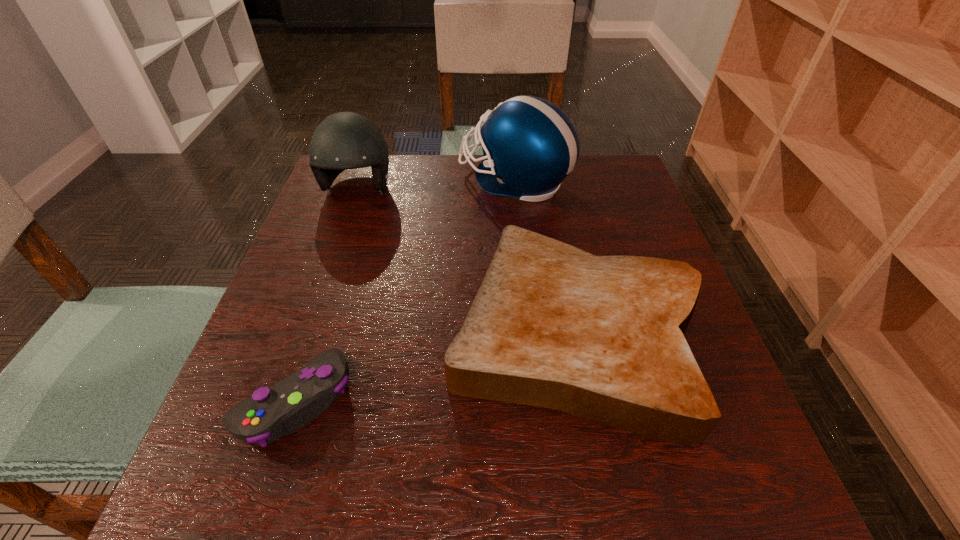
Find the location of `free space at the near right corner of the desktop`. free space at the near right corner of the desktop is located at coordinates (690, 503).

You are a GUI agent. You are given a task and a screenshot of the screen. Output one action in this format:
    pyautogui.click(x=<x>, y=<y>)
    Task: Click on the free space between the shortest object and the left football helmet
    The width and height of the screenshot is (960, 540).
    Given the screenshot: What is the action you would take?
    pyautogui.click(x=326, y=295)

You are a GUI agent. You are given a task and a screenshot of the screen. Output one action in this format:
    pyautogui.click(x=<x>, y=<y>)
    Task: Click on the free space that is in between the shortest object and the left football helmet
    
    Given the screenshot: What is the action you would take?
    click(x=326, y=295)

Identify the location of free space between the shortest object and the right football helmet. (404, 291).

Where is `vacant space in between the left football helmet and the shortest object`? The width and height of the screenshot is (960, 540). vacant space in between the left football helmet and the shortest object is located at coordinates (326, 295).

Where is `empty space between the shortest object and the right football helmet`? The height and width of the screenshot is (540, 960). empty space between the shortest object and the right football helmet is located at coordinates (404, 291).

Where is `empty space between the left football helmet and the right football helmet`? The height and width of the screenshot is (540, 960). empty space between the left football helmet and the right football helmet is located at coordinates (436, 185).

Find the location of `empty space that is in between the shortest object and the bread`. empty space that is in between the shortest object and the bread is located at coordinates (435, 367).

Image resolution: width=960 pixels, height=540 pixels. What are the coordinates of `free space between the left football helmet and the bread` in the screenshot? It's located at (467, 261).

Locate an element on the screen. This screenshot has height=540, width=960. object that is the second closest to the bread is located at coordinates (529, 145).